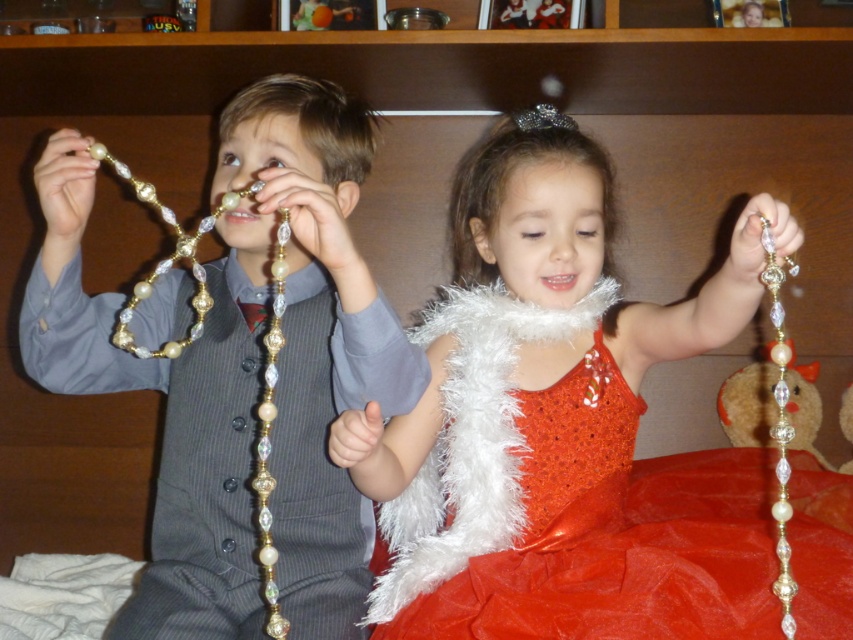
Between matte gold necklace at left and sparkly silver tiara at upper center, which one is positioned higher?

Positioned higher is sparkly silver tiara at upper center.

Between matte gold necklace at left and sparkly silver tiara at upper center, which one appears on the right side from the viewer's perspective?

Positioned to the right is sparkly silver tiara at upper center.

Who is more forward, (305,132) or (550,104)?

Point (305,132) is more forward.

Locate an element on the screen. The width and height of the screenshot is (853, 640). matte gold necklace at left is located at coordinates (242, 369).

Is the position of shiny gold necklace at center less distant than that of matte gold necklace at left?

Yes.

Which is more to the right, shiny gold necklace at center or matte gold necklace at left?

shiny gold necklace at center is more to the right.

Where is `shiny gold necklace at center`? The image size is (853, 640). shiny gold necklace at center is located at coordinates (558, 424).

Based on the photo, can you confirm if shiny gold necklace at center is positioned below sparkly silver tiara at upper center?

Yes.

Who is more distant from viewer, (495, 611) or (531, 115)?

Point (531, 115)

Which is in front, point (450, 406) or point (572, 122)?

Point (450, 406)

Image resolution: width=853 pixels, height=640 pixels. I want to click on shiny gold necklace at center, so click(x=558, y=424).